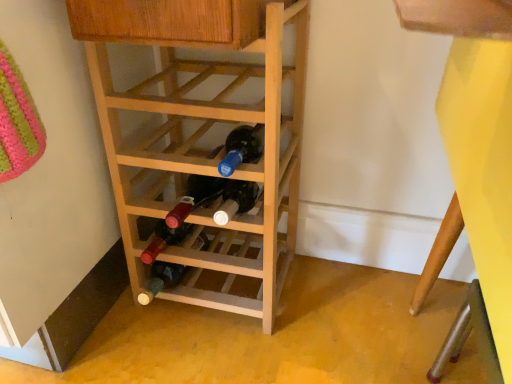
Question: In the image, is yellow matte bunk bed at lower right positioned in front of or behind natural wood wine rack at center?

Choices:
 (A) front
 (B) behind

Answer: (A)

Question: From a real-world perspective, relative to natural wood wine rack at center, is yellow matte bunk bed at lower right vertically above or below?

Choices:
 (A) below
 (B) above

Answer: (B)

Question: Is yellow matte bunk bed at lower right bigger or smaller than natural wood wine rack at center?

Choices:
 (A) big
 (B) small

Answer: (A)

Question: Is natural wood wine rack at center to the left or to the right of yellow matte bunk bed at lower right in the image?

Choices:
 (A) right
 (B) left

Answer: (B)

Question: Relative to yellow matte bunk bed at lower right, is natural wood wine rack at center in front or behind?

Choices:
 (A) front
 (B) behind

Answer: (B)

Question: Is natural wood wine rack at center spatially inside yellow matte bunk bed at lower right, or outside of it?

Choices:
 (A) inside
 (B) outside

Answer: (B)

Question: Is natural wood wine rack at center taller or shorter than yellow matte bunk bed at lower right?

Choices:
 (A) tall
 (B) short

Answer: (B)